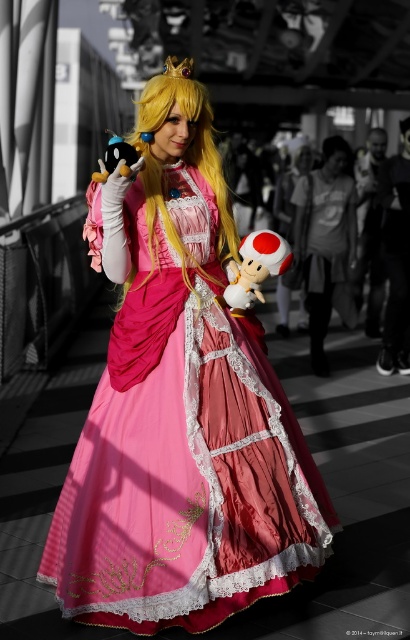
Can you confirm if matte pink dress at center is smaller than golden silky hair at center?

Incorrect, matte pink dress at center is not smaller in size than golden silky hair at center.

Between matte pink dress at center and golden silky hair at center, which one appears on the left side from the viewer's perspective?

Positioned to the left is golden silky hair at center.

Find the location of a particular element. The height and width of the screenshot is (640, 410). matte pink dress at center is located at coordinates (179, 406).

Is point (184, 88) farther from camera compared to point (234, 260)?

That is False.

The width and height of the screenshot is (410, 640). What do you see at coordinates (186, 152) in the screenshot?
I see `golden silky hair at center` at bounding box center [186, 152].

Where is `golden silky hair at center`? Image resolution: width=410 pixels, height=640 pixels. golden silky hair at center is located at coordinates (186, 152).

Can you confirm if matte pink dress at center is wider than white plush toy at center?

Yes, matte pink dress at center is wider than white plush toy at center.

Between matte pink dress at center and white plush toy at center, which one appears on the left side from the viewer's perspective?

matte pink dress at center is more to the left.

Between point (237, 435) and point (271, 272), which one is positioned behind?

Point (271, 272)

You are a GUI agent. You are given a task and a screenshot of the screen. Output one action in this format:
    pyautogui.click(x=<x>, y=<y>)
    Task: Click on the matte pink dress at center
    This screenshot has width=410, height=640.
    Given the screenshot: What is the action you would take?
    pyautogui.click(x=179, y=406)